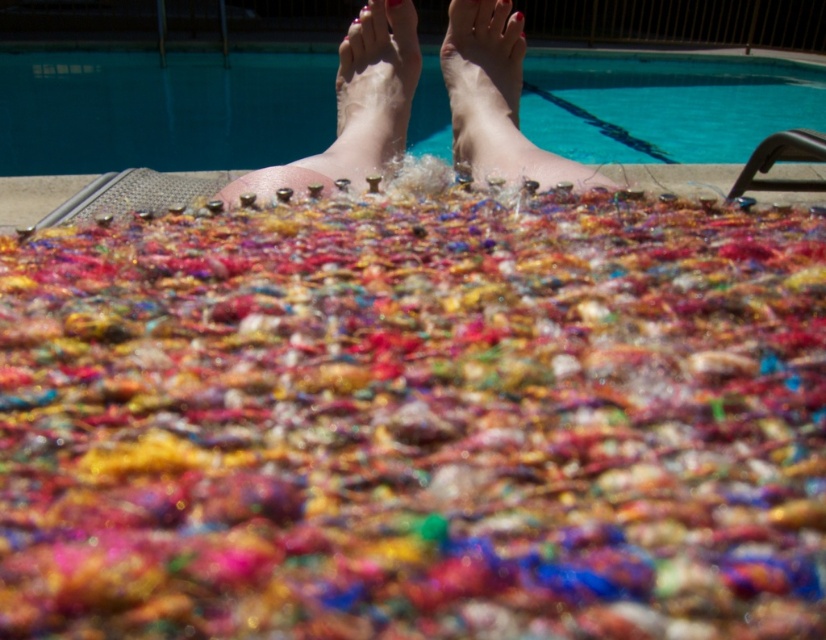
How far apart are nail polish toes at upper center and matte pink nail at center?

27.46 centimeters

What do you see at coordinates (485, 88) in the screenshot?
I see `nail polish toes at upper center` at bounding box center [485, 88].

Is point (490, 8) less distant than point (396, 3)?

That is False.

I want to click on nail polish toes at upper center, so click(x=485, y=88).

Can you confirm if shiny multicolored fabric at center is wider than blue glossy water at upper center?

No, shiny multicolored fabric at center is not wider than blue glossy water at upper center.

What do you see at coordinates (416, 420) in the screenshot? I see `shiny multicolored fabric at center` at bounding box center [416, 420].

Find the location of a particular element. Image resolution: width=826 pixels, height=640 pixels. shiny multicolored fabric at center is located at coordinates (416, 420).

Is blue glossy water at upper center bigger than nail polish feet at upper center?

Yes, blue glossy water at upper center is bigger than nail polish feet at upper center.

Between point (810, 108) and point (357, 141), which one is positioned in front?

Point (357, 141)

Is point (658, 90) in front of point (338, 128)?

No, it is behind (338, 128).

I want to click on blue glossy water at upper center, so click(160, 109).